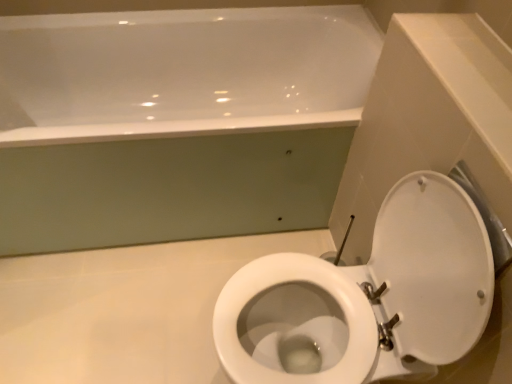
Question: Does white glossy bathtub at upper center have a greater height compared to white glossy toilet at lower right?

Choices:
 (A) yes
 (B) no

Answer: (B)

Question: Would you say white glossy bathtub at upper center is a long distance from white glossy toilet at lower right?

Choices:
 (A) yes
 (B) no

Answer: (B)

Question: From a real-world perspective, is white glossy bathtub at upper center beneath white glossy toilet at lower right?

Choices:
 (A) no
 (B) yes

Answer: (B)

Question: Is white glossy bathtub at upper center beside white glossy toilet at lower right?

Choices:
 (A) yes
 (B) no

Answer: (B)

Question: Does white glossy bathtub at upper center appear on the right side of white glossy toilet at lower right?

Choices:
 (A) no
 (B) yes

Answer: (A)

Question: Can you confirm if white glossy bathtub at upper center is positioned to the left of white glossy toilet at lower right?

Choices:
 (A) no
 (B) yes

Answer: (B)

Question: Are white glossy toilet at lower right and white glossy bathtub at upper center located far from each other?

Choices:
 (A) no
 (B) yes

Answer: (A)

Question: Can we say white glossy toilet at lower right lies outside white glossy bathtub at upper center?

Choices:
 (A) no
 (B) yes

Answer: (B)

Question: Considering the relative sizes of white glossy toilet at lower right and white glossy bathtub at upper center in the image provided, is white glossy toilet at lower right bigger than white glossy bathtub at upper center?

Choices:
 (A) yes
 (B) no

Answer: (B)

Question: Does white glossy toilet at lower right have a greater width compared to white glossy bathtub at upper center?

Choices:
 (A) yes
 (B) no

Answer: (B)

Question: Does white glossy toilet at lower right lie in front of white glossy bathtub at upper center?

Choices:
 (A) yes
 (B) no

Answer: (A)

Question: From the image's perspective, does white glossy toilet at lower right appear higher than white glossy bathtub at upper center?

Choices:
 (A) yes
 (B) no

Answer: (B)

Question: From their relative heights in the image, would you say white glossy bathtub at upper center is taller or shorter than white glossy toilet at lower right?

Choices:
 (A) tall
 (B) short

Answer: (B)